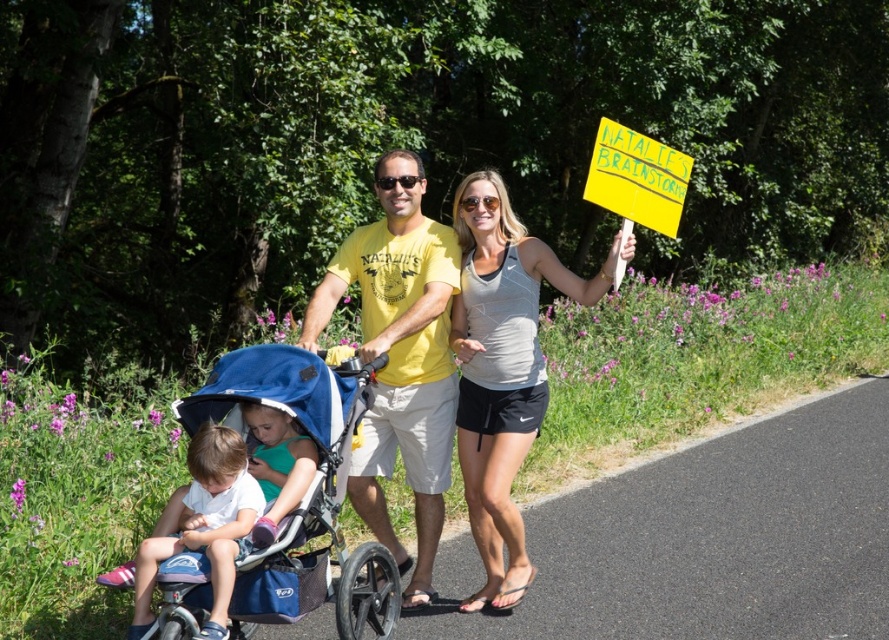
Between blue fabric stroller at left and matte green shirt at center, which one has less height?

matte green shirt at center is shorter.

Is point (335, 560) more distant than point (279, 413)?

Yes, point (335, 560) is behind point (279, 413).

Is point (367, 364) positioned in front of point (271, 412)?

No, (367, 364) is behind (271, 412).

Where is `blue fabric stroller at left`? This screenshot has height=640, width=889. blue fabric stroller at left is located at coordinates (303, 493).

Which is above, yellow cotton t-shirt at center or gray athletic tank top at upper center?

Positioned higher is yellow cotton t-shirt at center.

Measure the distance between yellow cotton t-shirt at center and gray athletic tank top at upper center.

They are 15.32 inches apart.

Between point (379, 424) and point (495, 499), which one is positioned in front?

Point (495, 499) is more forward.

Find the location of a particular element. yellow cotton t-shirt at center is located at coordinates (399, 356).

Who is positioned more to the left, yellow cotton t-shirt at center or matte green shirt at center?

matte green shirt at center is more to the left.

Does point (358, 243) come behind point (294, 429)?

Yes, it is.

Who is more forward, (x=415, y=532) or (x=268, y=420)?

Point (x=268, y=420)

Where is `yellow cotton t-shirt at center`? yellow cotton t-shirt at center is located at coordinates (399, 356).